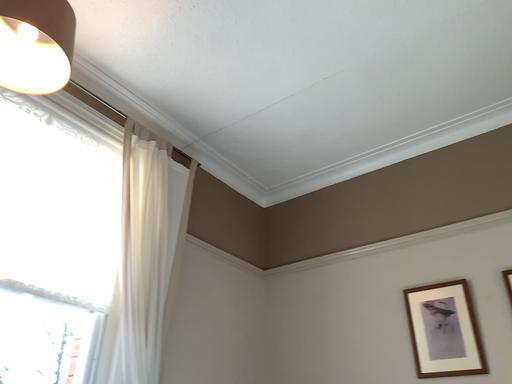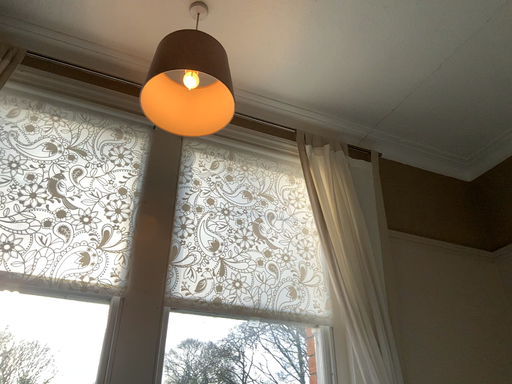
Question: How did the camera likely rotate when shooting the video?

Choices:
 (A) rotated right
 (B) rotated left

Answer: (B)